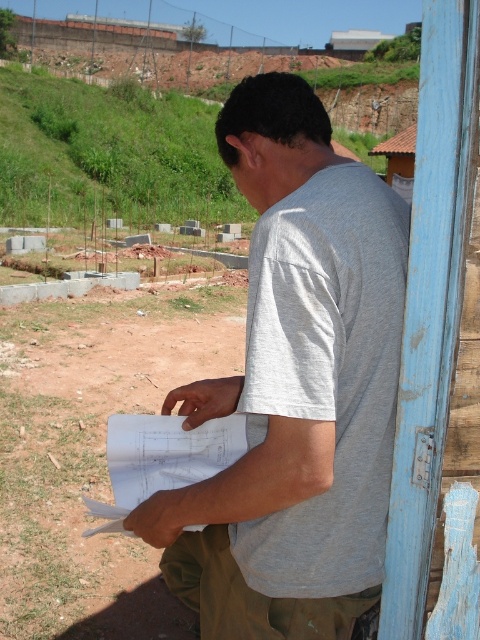
Who is more distant from viewer, (260, 125) or (33, 513)?

The point (33, 513) is more distant.

Between gray matte shirt at center and brown dirt field at lower left, which one has more height?

gray matte shirt at center

Identify the location of gray matte shirt at center. (296, 387).

Locate an element on the screen. gray matte shirt at center is located at coordinates (x=296, y=387).

Does point (249, 138) come farther from viewer compared to point (204, 560)?

That is False.

Who is more distant from viewer, [251,417] or [348,621]?

The point [348,621] is behind.

The height and width of the screenshot is (640, 480). What do you see at coordinates (296, 387) in the screenshot?
I see `gray matte shirt at center` at bounding box center [296, 387].

Identify the location of gray matte shirt at center. This screenshot has height=640, width=480. (x=296, y=387).

Who is positioned more to the right, brown dirt field at lower left or khaki fabric at lower center?

Positioned to the right is khaki fabric at lower center.

Find the location of a particular element. brown dirt field at lower left is located at coordinates (93, 451).